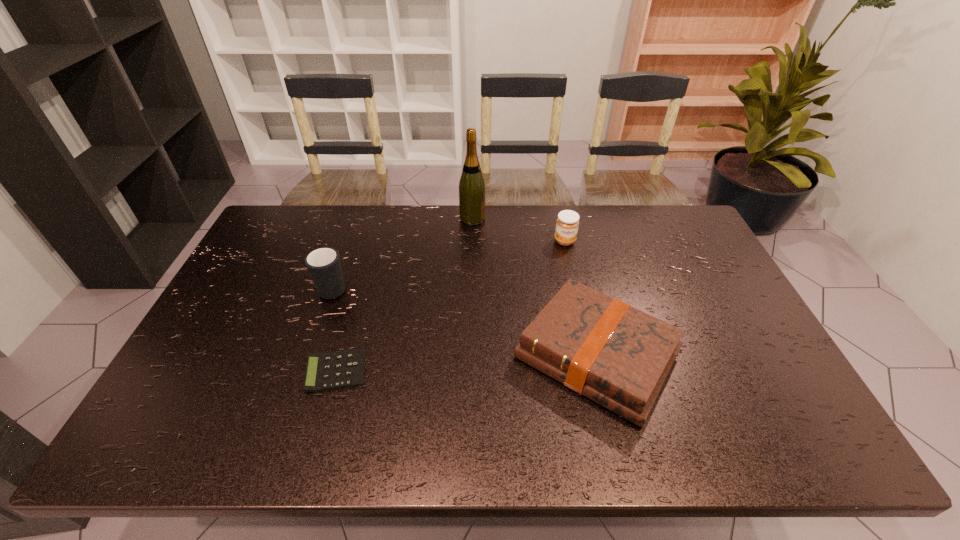
The height and width of the screenshot is (540, 960). What are the coordinates of `vacant space at the far right corner of the desktop` in the screenshot? It's located at (686, 222).

At what (x,y) coordinates should I click in order to perform the action: click on free space at the near right corner. Please return your answer as a coordinate pair (x, y). Looking at the image, I should click on (795, 441).

This screenshot has width=960, height=540. Identify the location of vacant space that is in between the mug and the calculator. [335, 329].

You are a GUI agent. You are given a task and a screenshot of the screen. Output one action in this format:
    pyautogui.click(x=<x>, y=<y>)
    Task: Click on the free space between the calculator and the hardback book
    
    Given the screenshot: What is the action you would take?
    pyautogui.click(x=467, y=363)

This screenshot has width=960, height=540. Find the location of `free spot between the hardback book and the wine bottle`. free spot between the hardback book and the wine bottle is located at coordinates (535, 287).

What are the coordinates of `unoccupied position between the second tallest object and the calculator` in the screenshot? It's located at (335, 329).

Image resolution: width=960 pixels, height=540 pixels. I want to click on free point between the hardback book and the shortest object, so click(467, 363).

I want to click on empty space between the mug and the shortest object, so click(335, 329).

Where is `blank region between the second farthest object and the calculator`? blank region between the second farthest object and the calculator is located at coordinates (450, 306).

Find the location of a particular element. The image size is (960, 540). vacant area that lies between the jam and the tallest object is located at coordinates (518, 230).